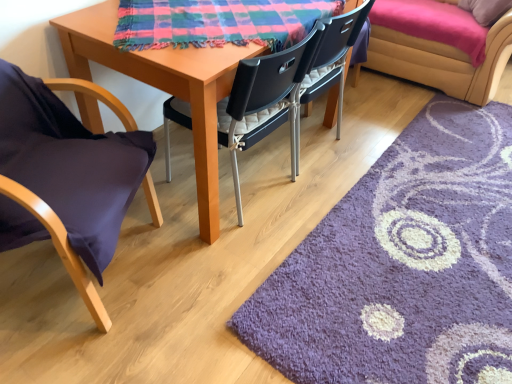
Question: Does plaid fabric at center turn towards purple shaggy rug at lower right?

Choices:
 (A) no
 (B) yes

Answer: (A)

Question: Is plaid fabric at center not inside purple shaggy rug at lower right?

Choices:
 (A) no
 (B) yes

Answer: (B)

Question: From a real-world perspective, is plaid fabric at center located higher than purple shaggy rug at lower right?

Choices:
 (A) yes
 (B) no

Answer: (A)

Question: Considering the relative positions of plaid fabric at center and purple shaggy rug at lower right in the image provided, is plaid fabric at center to the right of purple shaggy rug at lower right from the viewer's perspective?

Choices:
 (A) no
 (B) yes

Answer: (A)

Question: From the image's perspective, does plaid fabric at center appear lower than purple shaggy rug at lower right?

Choices:
 (A) no
 (B) yes

Answer: (A)

Question: From the image's perspective, is plaid fabric at center on top of purple shaggy rug at lower right?

Choices:
 (A) no
 (B) yes

Answer: (B)

Question: From a real-world perspective, is velvet yellow couch at upper right positioned over purple fabric chair at left, marked as the first chair in a left-to-right arrangement, based on gravity?

Choices:
 (A) yes
 (B) no

Answer: (B)

Question: Is velvet yellow couch at upper right oriented towards purple fabric chair at left, marked as the first chair in a left-to-right arrangement?

Choices:
 (A) yes
 (B) no

Answer: (A)

Question: Can you confirm if velvet yellow couch at upper right is positioned to the right of purple fabric chair at left, the 2th chair positioned from the right?

Choices:
 (A) yes
 (B) no

Answer: (A)

Question: Does velvet yellow couch at upper right have a lesser width compared to purple fabric chair at left, marked as the first chair in a left-to-right arrangement?

Choices:
 (A) no
 (B) yes

Answer: (A)

Question: Does velvet yellow couch at upper right have a larger size compared to purple fabric chair at left, the 2th chair positioned from the right?

Choices:
 (A) no
 (B) yes

Answer: (B)

Question: Considering the relative sizes of velvet yellow couch at upper right and purple fabric chair at left, the 2th chair positioned from the right, in the image provided, is velvet yellow couch at upper right shorter than purple fabric chair at left, the 2th chair positioned from the right,?

Choices:
 (A) no
 (B) yes

Answer: (B)

Question: Is velvet yellow couch at upper right not near purple shaggy rug at lower right?

Choices:
 (A) yes
 (B) no

Answer: (A)